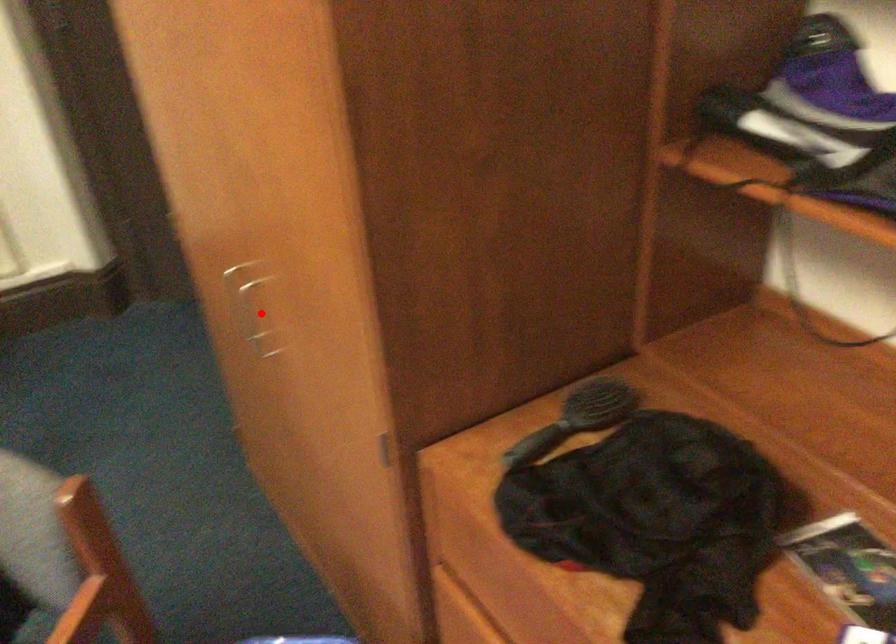
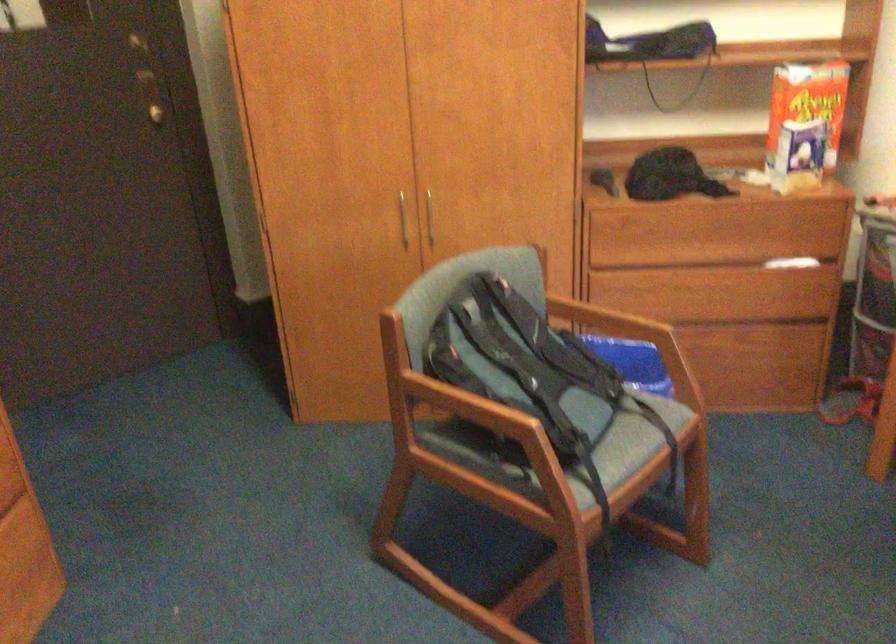
Find the pixel in the second image that matches the highlighted location in the first image.

(402, 220)